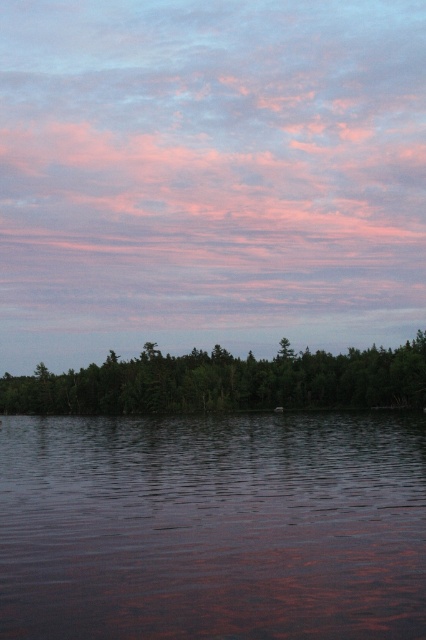
Can you confirm if pink fluffy clouds at upper center is positioned to the left of smooth dark water at center?

Correct, you'll find pink fluffy clouds at upper center to the left of smooth dark water at center.

Who is more distant from viewer, (212, 72) or (36, 452)?

The point (212, 72) is behind.

Where is `pink fluffy clouds at upper center`? Image resolution: width=426 pixels, height=640 pixels. pink fluffy clouds at upper center is located at coordinates (210, 163).

Between smooth dark water at center and green matte tree at lower center, which one has more height?

green matte tree at lower center is taller.

Is smooth dark water at center closer to camera compared to green matte tree at lower center?

That is True.

Which is behind, point (32, 444) or point (31, 388)?

The point (31, 388) is more distant.

Locate an element on the screen. This screenshot has width=426, height=640. smooth dark water at center is located at coordinates (213, 528).

Does point (207, 244) come in front of point (25, 403)?

No, it is not.

Based on the photo, between pink fluffy clouds at upper center and green matte tree at lower center, which one has less height?

green matte tree at lower center is shorter.

You are a GUI agent. You are given a task and a screenshot of the screen. Output one action in this format:
    pyautogui.click(x=<x>, y=<y>)
    Task: Click on the pink fluffy clouds at upper center
    The height and width of the screenshot is (640, 426).
    Given the screenshot: What is the action you would take?
    pyautogui.click(x=210, y=163)